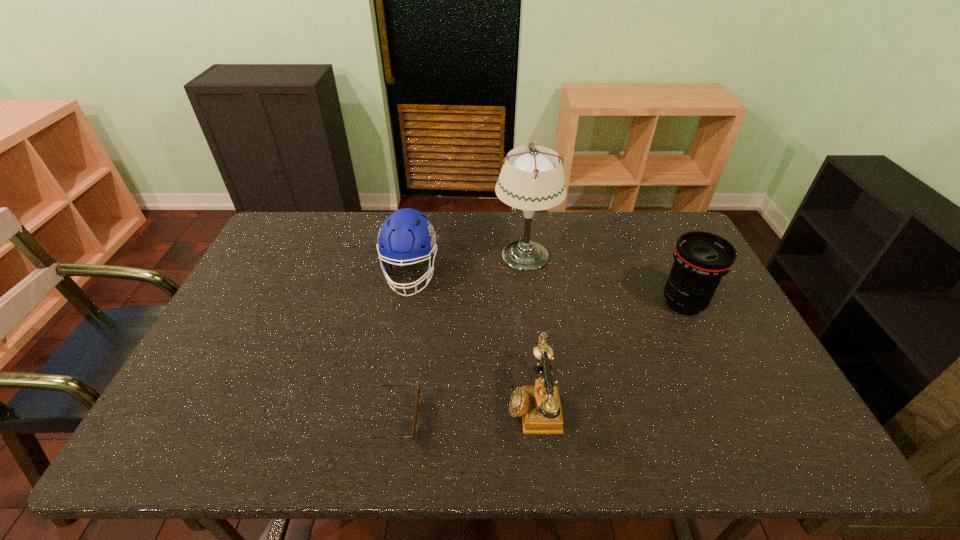
You are a GUI agent. You are given a task and a screenshot of the screen. Output one action in this format:
    pyautogui.click(x=<x>, y=<y>)
    Task: Click on the vacant space located 0.060m on the dial number of the telephone
    The width and height of the screenshot is (960, 540).
    Given the screenshot: What is the action you would take?
    pyautogui.click(x=483, y=402)

You are a GUI agent. You are given a task and a screenshot of the screen. Output one action in this format:
    pyautogui.click(x=<x>, y=<y>)
    Task: Click on the free space located 0.280m on the dial number of the telephone
    The height and width of the screenshot is (540, 960).
    Given the screenshot: What is the action you would take?
    pyautogui.click(x=390, y=402)

This screenshot has width=960, height=540. I want to click on free space located on the dial number of the telephone, so click(x=441, y=402).

At what (x,y) coordinates should I click in order to perform the action: click on free space located at the front view of the spectacles. Please return your answer as a coordinate pair (x, y). The width and height of the screenshot is (960, 540). Looking at the image, I should click on (496, 420).

Where is `lampshade at the far edge`? This screenshot has height=540, width=960. lampshade at the far edge is located at coordinates (532, 178).

You are a GUI agent. You are given a task and a screenshot of the screen. Output one action in this format:
    pyautogui.click(x=<x>, y=<y>)
    Task: Click on the football helmet that is at the far edge
    This screenshot has width=960, height=540.
    Given the screenshot: What is the action you would take?
    pyautogui.click(x=406, y=236)

I want to click on telephone that is at the near edge, so click(x=539, y=406).

The width and height of the screenshot is (960, 540). I want to click on spectacles present at the near edge, so click(414, 431).

The image size is (960, 540). In order to click on object present at the right edge in this screenshot , I will do `click(701, 259)`.

Find the location of a particular element. This screenshot has height=540, width=960. vacant space at the far edge is located at coordinates (323, 241).